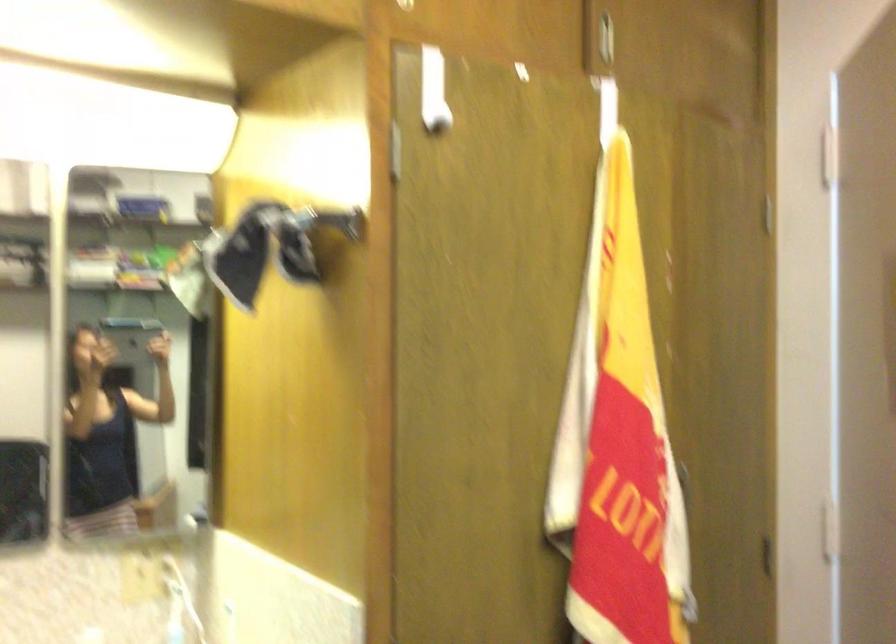
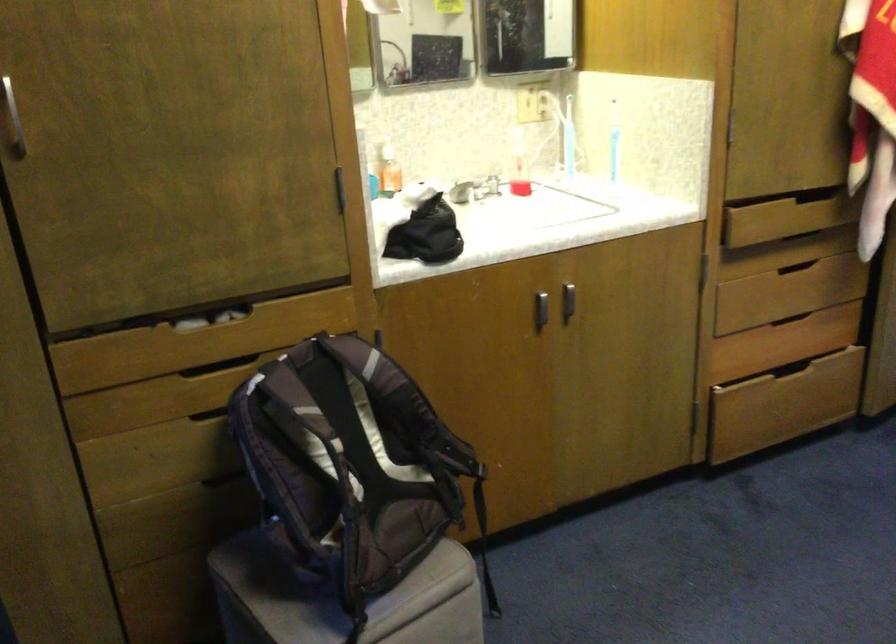
The first image is from the beginning of the video and the second image is from the end. How did the camera likely rotate when shooting the video?

The camera rotated toward left-down.